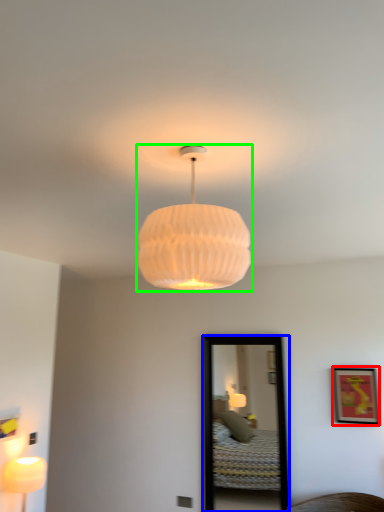
Question: Estimate the real-world distances between objects in this image. Which object is closer to picture frame (highlighted by a red box), mirror (highlighted by a blue box) or lamp (highlighted by a green box)?

Choices:
 (A) mirror
 (B) lamp

Answer: (A)